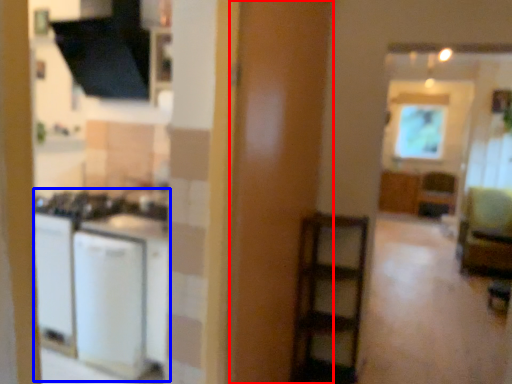
Question: Which object is further to the camera taking this photo, screen door (highlighted by a red box) or appliance (highlighted by a blue box)?

Choices:
 (A) screen door
 (B) appliance

Answer: (B)